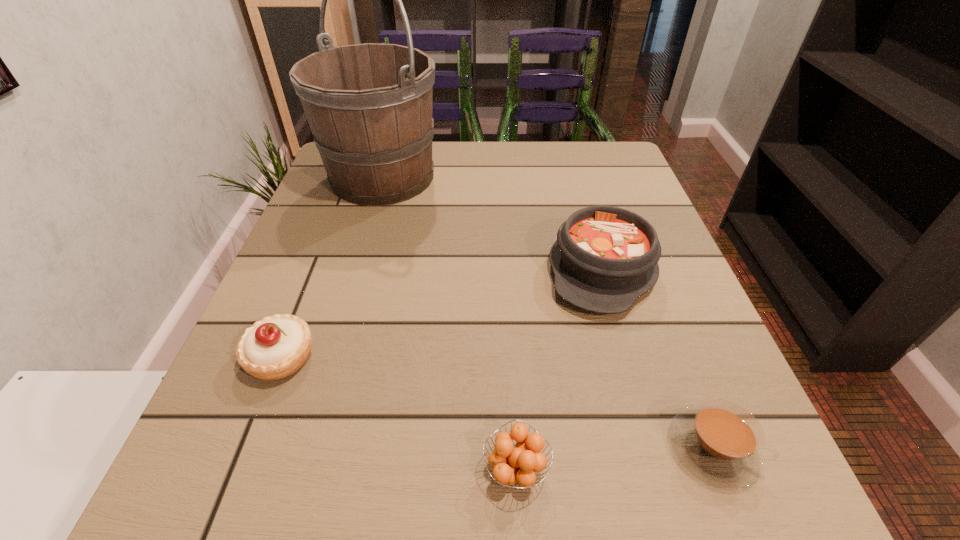
In the image, there is a desktop. Where is `free space at the far edge`? This screenshot has height=540, width=960. free space at the far edge is located at coordinates (x=462, y=172).

Locate an element on the screen. vacant space at the left edge of the desktop is located at coordinates (307, 210).

The height and width of the screenshot is (540, 960). Find the location of `free space at the right edge of the desktop`. free space at the right edge of the desktop is located at coordinates (674, 258).

Find the location of `vacant space at the near left corner of the desktop`. vacant space at the near left corner of the desktop is located at coordinates (199, 467).

You are a GUI agent. You are given a task and a screenshot of the screen. Output one action in this format:
    pyautogui.click(x=<x>, y=<y>)
    Task: Click on the vacant region at the far right corner of the desktop
    
    Given the screenshot: What is the action you would take?
    pyautogui.click(x=595, y=166)

In the image, there is a desktop. Identify the location of blank space at the near right corner. This screenshot has height=540, width=960. (756, 520).

You are a GUI agent. You are given a task and a screenshot of the screen. Output one action in this format:
    pyautogui.click(x=<x>, y=<y>)
    Task: Click on the empty location between the orange fruit and the second farthest object
    The image size is (960, 540).
    Given the screenshot: What is the action you would take?
    pyautogui.click(x=559, y=369)

Find the location of a particular element. free space between the cappuccino and the bucket is located at coordinates (547, 313).

In order to click on empty space that is in between the cappuccino and the orange fruit in this screenshot , I will do `click(614, 459)`.

Locate an element on the screen. The width and height of the screenshot is (960, 540). empty space that is in between the casserole and the cappuccino is located at coordinates (657, 359).